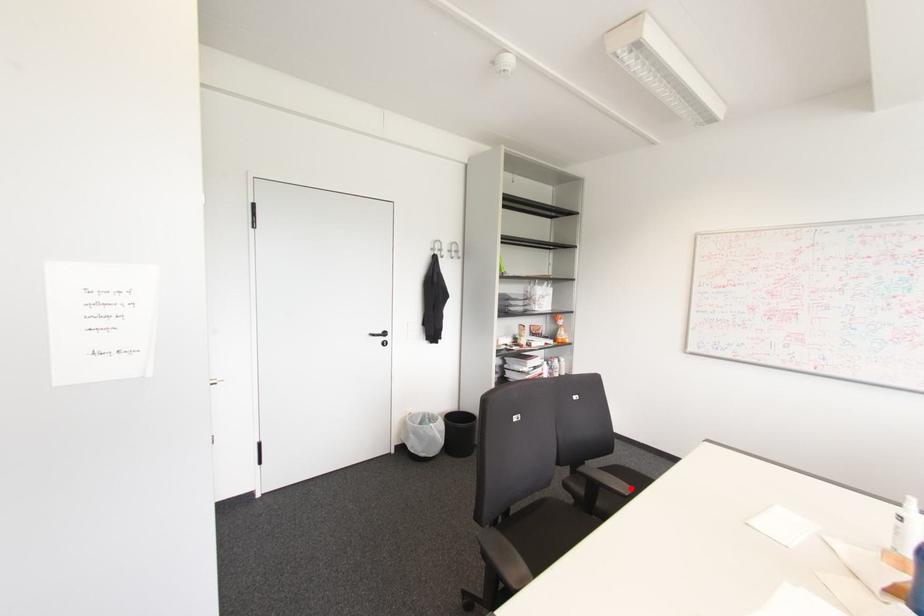
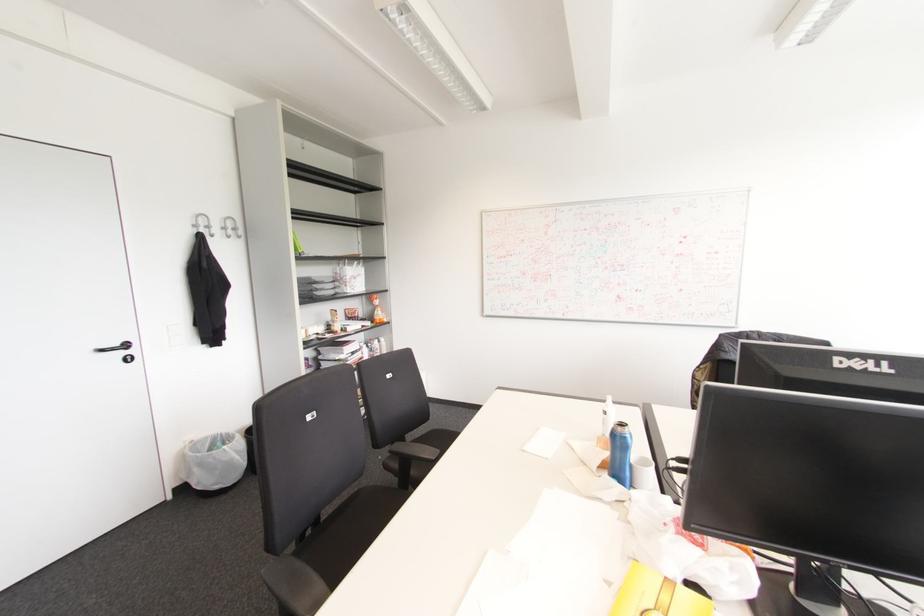
The point at the highlighted location is marked in the first image. Where is the corresponding point in the second image?

(438, 451)